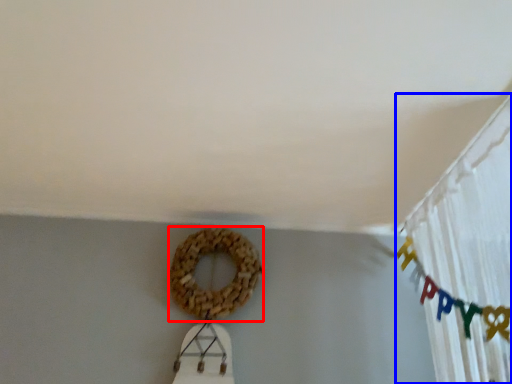
Question: Which point is further to the camera, bagel (highlighted by a red box) or curtain (highlighted by a blue box)?

Choices:
 (A) bagel
 (B) curtain

Answer: (A)